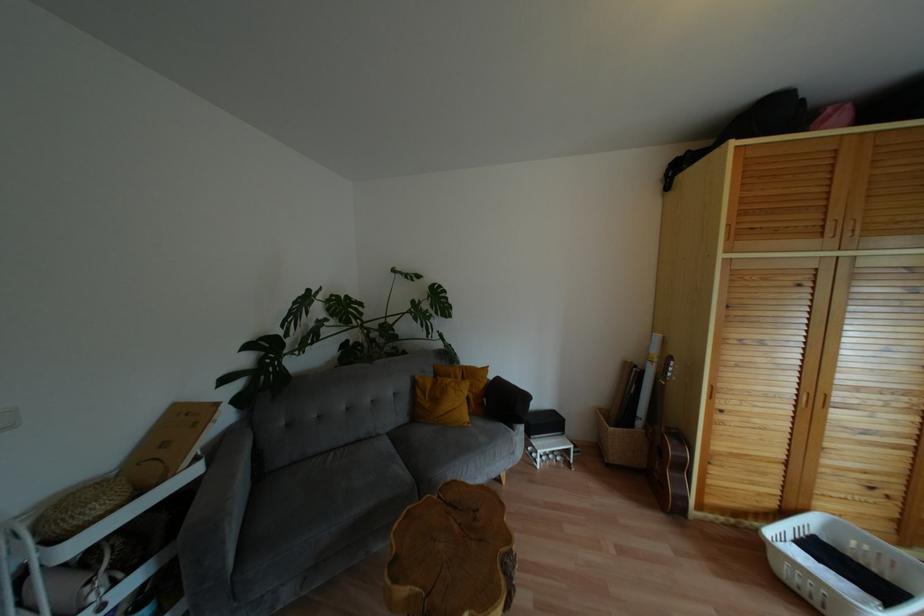
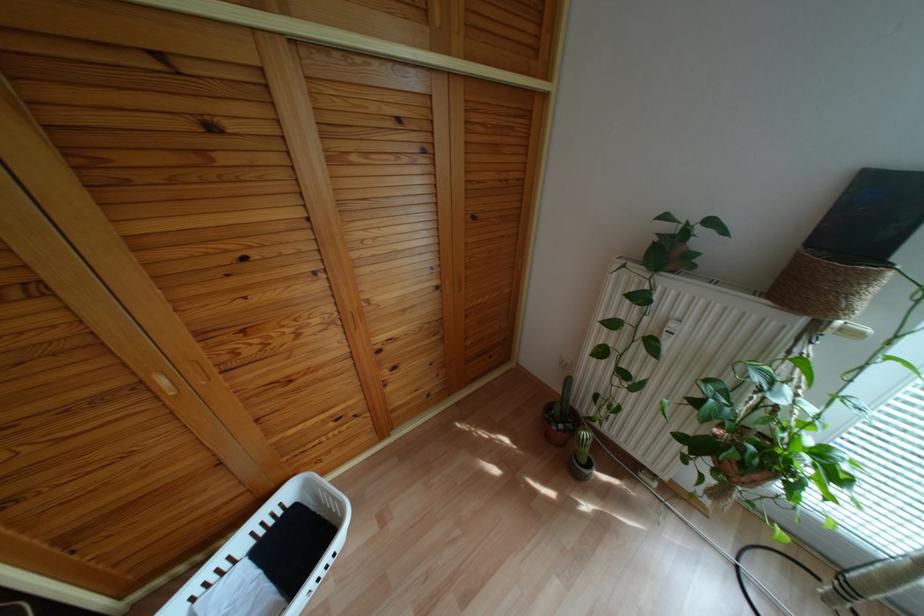
Where in the second image is the point corresponding to point (808, 523) from the first image?

(287, 493)